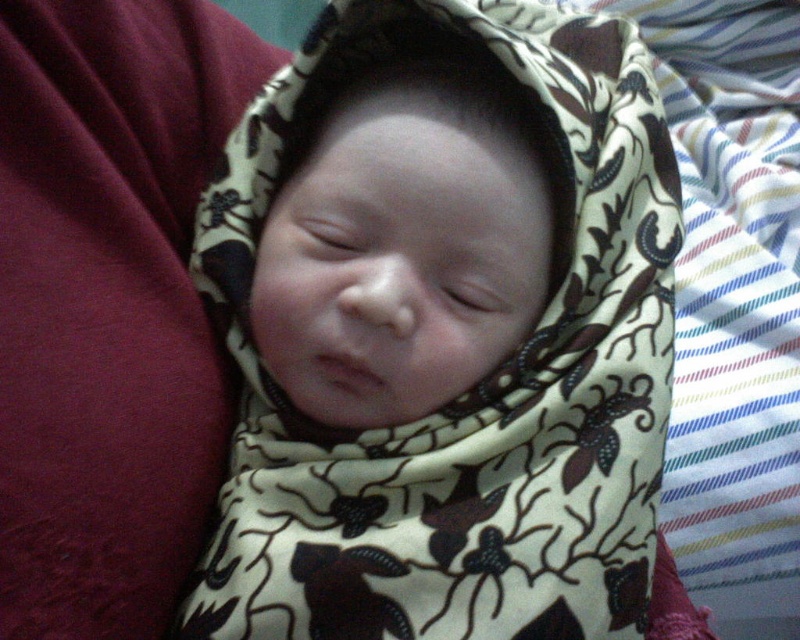
Question: Which point is closer to the camera?

Choices:
 (A) (476, 492)
 (B) (260, 342)

Answer: (A)

Question: Where is brown printed fabric at center located in relation to smooth beige swaddle at center in the image?

Choices:
 (A) below
 (B) above

Answer: (A)

Question: Which object is farther from the camera taking this photo?

Choices:
 (A) smooth beige swaddle at center
 (B) brown printed fabric at center

Answer: (A)

Question: Can you confirm if brown printed fabric at center is positioned to the right of smooth beige swaddle at center?

Choices:
 (A) yes
 (B) no

Answer: (A)

Question: Can you confirm if brown printed fabric at center is thinner than smooth beige swaddle at center?

Choices:
 (A) yes
 (B) no

Answer: (B)